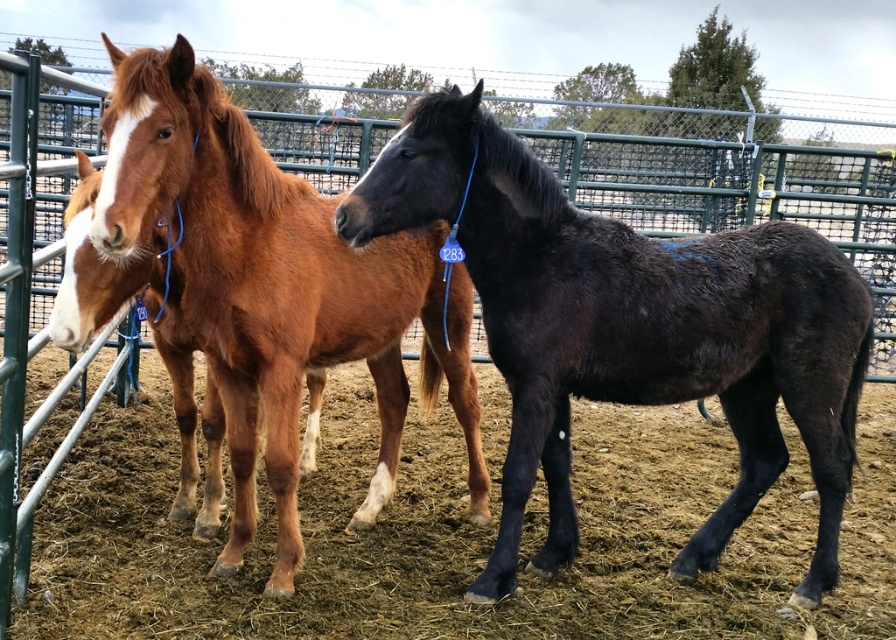
You are standing at the entrance of the fenced enclosure and see two points marked in the image. The first point is at coordinate point (402, 492) and the second point is at coordinate point (562, 340). Which point is closer to you?

Point (402, 492) is behind point (562, 340), so the point closer to you is point (562, 340).